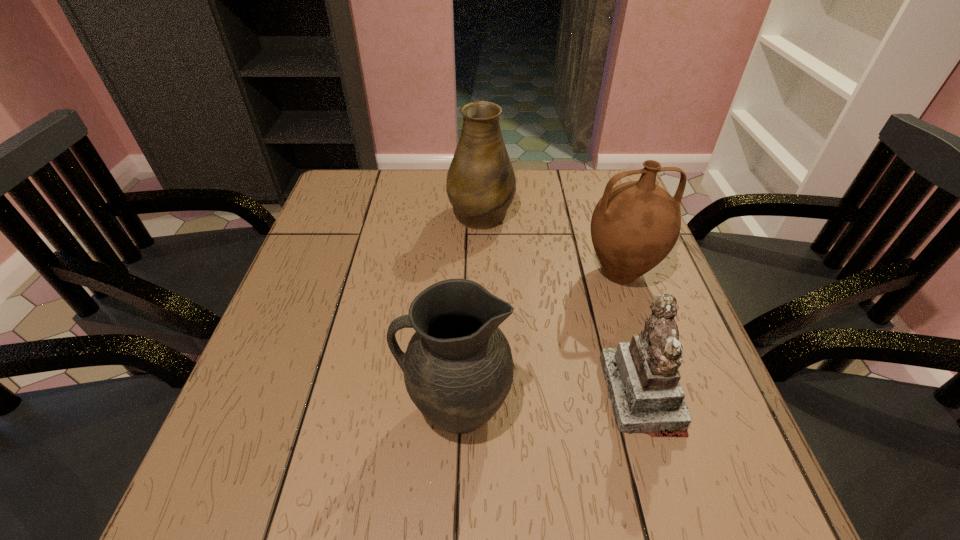
Identify the location of the farthest pitcher. (481, 185).

Where is `the rightmost pitcher`? The height and width of the screenshot is (540, 960). the rightmost pitcher is located at coordinates click(635, 225).

This screenshot has width=960, height=540. Identify the location of the second nearest pitcher. (635, 225).

Locate an element on the screen. This screenshot has height=540, width=960. the nearest pitcher is located at coordinates (458, 368).

Where is `the shortest object`? the shortest object is located at coordinates (642, 377).

The image size is (960, 540). I want to click on vacant space situated on the handle side of the farthest object, so click(481, 169).

What are the coordinates of `free space located 0.080m on the handle side of the farthest object` in the screenshot? It's located at (481, 177).

You are a GUI agent. You are given a task and a screenshot of the screen. Output one action in this format:
    pyautogui.click(x=<x>, y=<y>)
    Task: Click on the vacant space located on the handle side of the farthest object
    This screenshot has height=540, width=960.
    Given the screenshot: What is the action you would take?
    pyautogui.click(x=481, y=169)

Image resolution: width=960 pixels, height=540 pixels. Find the location of `vacant space located 0.140m on the back of the rightmost pitcher`. vacant space located 0.140m on the back of the rightmost pitcher is located at coordinates (601, 216).

Where is `free point located on the side of the nearest pitcher with the handle`? This screenshot has height=540, width=960. free point located on the side of the nearest pitcher with the handle is located at coordinates (326, 409).